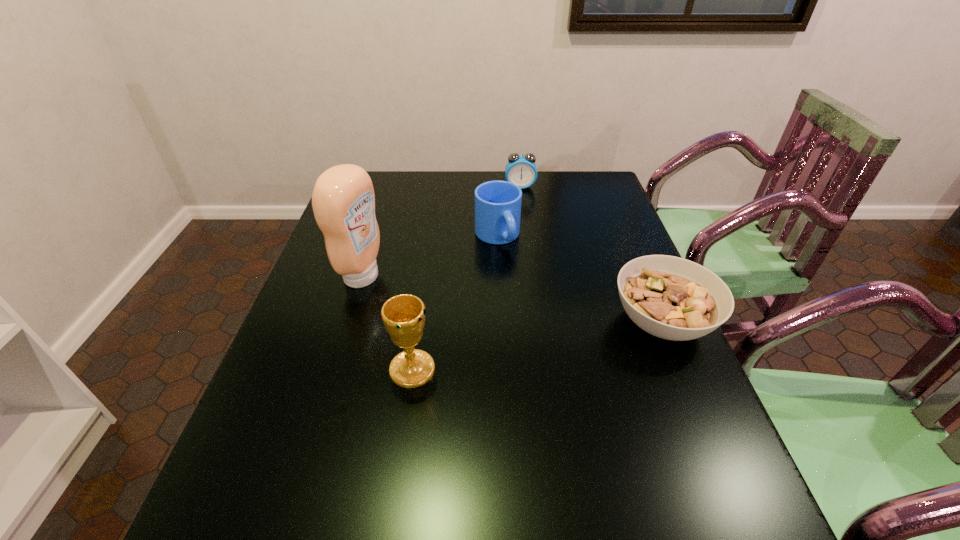
Find the location of a particular element. The width and height of the screenshot is (960, 540). vacant area that lies between the mug and the rightmost object is located at coordinates (580, 279).

Locate an element on the screen. This screenshot has width=960, height=540. free space between the leftmost object and the fourth nearest object is located at coordinates (430, 256).

Where is `free space that is in between the farthest object and the leftmost object`? free space that is in between the farthest object and the leftmost object is located at coordinates [x=441, y=232].

Find the location of a particular element. free space between the rightmost object and the chalice is located at coordinates point(537,346).

The width and height of the screenshot is (960, 540). I want to click on vacant space that's between the rightmost object and the alarm clock, so click(x=591, y=254).

Choose which object is the second nearest neighbor to the chalice. Please provide its 2D coordinates. Your answer should be formatted as a tuple, i.e. [(x, y)], where the tuple contains the x and y coordinates of a point satisfying the conditions above.

[(497, 203)]

This screenshot has width=960, height=540. What are the coordinates of `object that is the fourth closest one to the second tallest object` in the screenshot? It's located at (521, 170).

Identify the location of free space that satisfies the following two spatial constraints: 1. on the front side of the rightmost object; 2. on the right side of the second farthest object. The width and height of the screenshot is (960, 540). (502, 322).